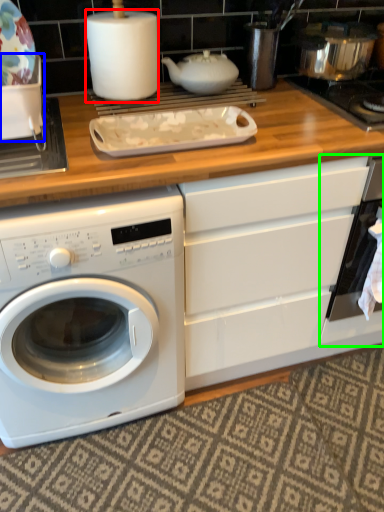
Question: Based on their relative distances, which object is farther from paper towel (highlighted by a red box)? Choose from appliance (highlighted by a blue box) and oven (highlighted by a green box).

Choices:
 (A) appliance
 (B) oven

Answer: (B)